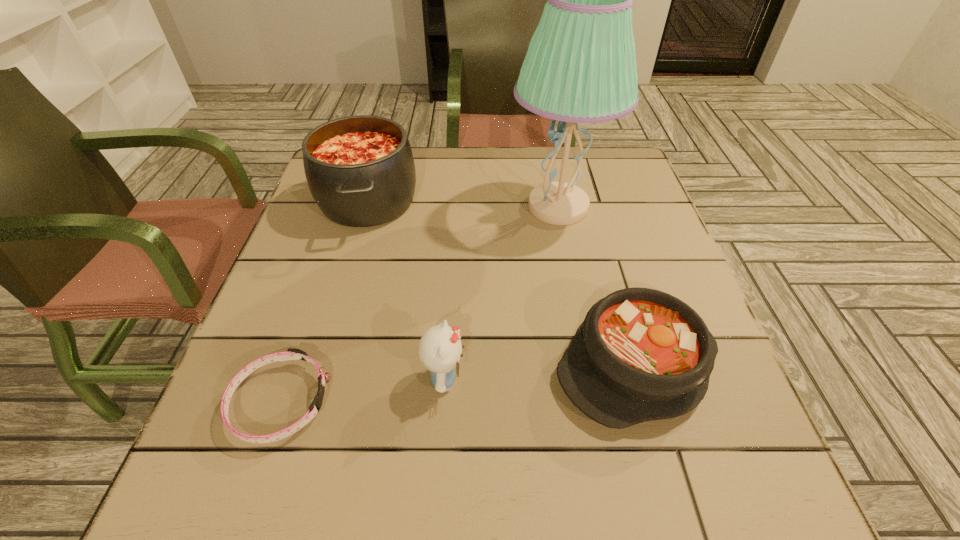
The height and width of the screenshot is (540, 960). I want to click on vacant space situated 0.100m on the front-facing side of the third object from right to left, so pos(522,379).

Locate an element on the screen. The width and height of the screenshot is (960, 540). free space located 0.230m on the left of the fourth tallest object is located at coordinates (424, 365).

This screenshot has width=960, height=540. What are the coordinates of `vacant point located with the buckle on the shortest object` in the screenshot? It's located at (440, 402).

You are a GUI agent. You are given a task and a screenshot of the screen. Output one action in this format:
    pyautogui.click(x=<x>, y=<y>)
    Task: Click on the lamp at the far edge
    This screenshot has height=540, width=960.
    Given the screenshot: What is the action you would take?
    pyautogui.click(x=580, y=67)

Identify the location of casserole positioned at the far edge. This screenshot has width=960, height=540. (360, 170).

At what (x,y) coordinates should I click in order to perform the action: click on casserole that is at the left edge. Please return your answer as a coordinate pair (x, y). Looking at the image, I should click on (360, 170).

Identify the location of dog collar present at the left edge. The width and height of the screenshot is (960, 540). (291, 354).

I want to click on lamp that is at the right edge, so click(580, 67).

The height and width of the screenshot is (540, 960). I want to click on casserole at the right edge, so click(x=641, y=354).

Locate an element on the screen. This screenshot has height=540, width=960. object at the far left corner is located at coordinates (360, 170).